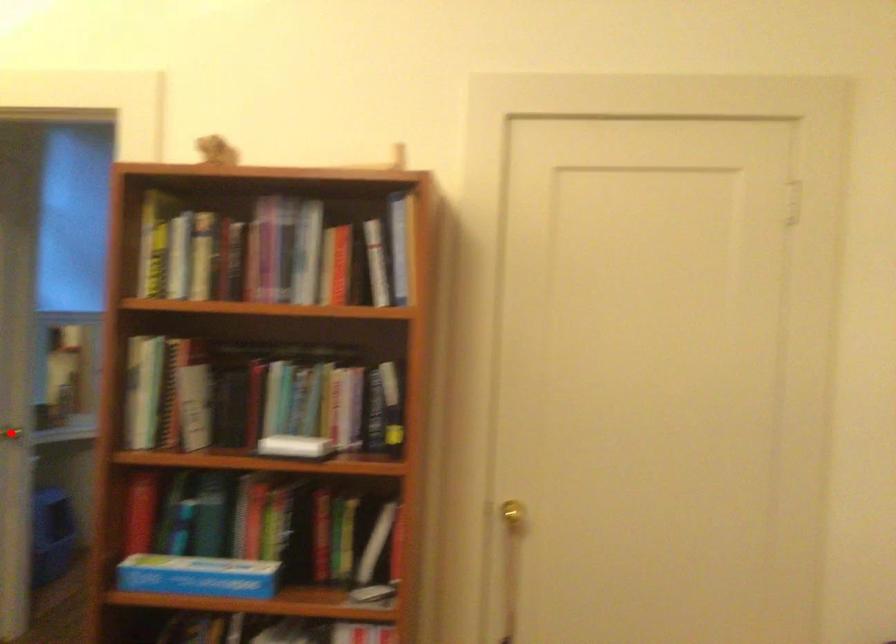
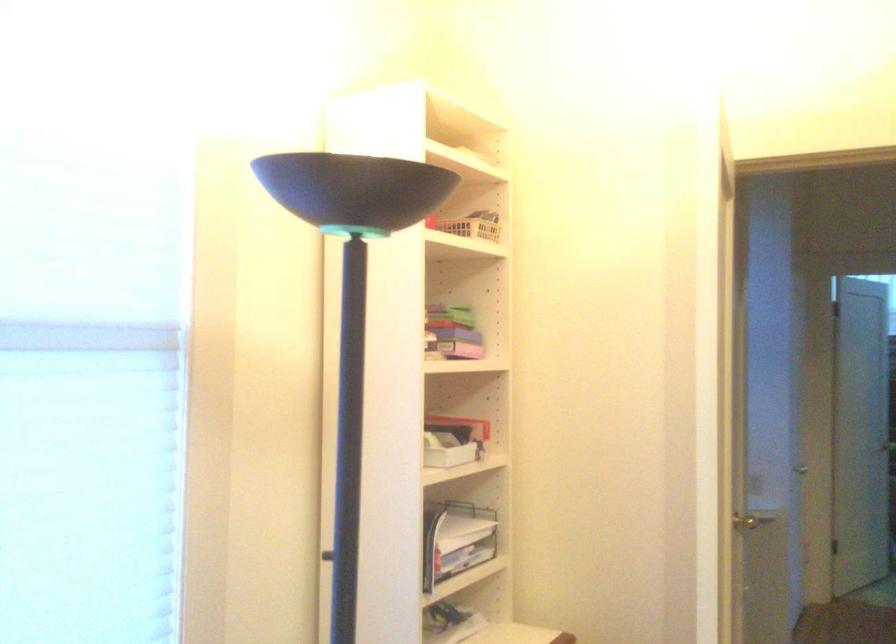
Question: I am providing you with two images of the same scene from different viewpoints. Image1 has a red point marked. In image2, the corresponding 3D location appears at what relative position? Reply with the corresponding letter.

Choices:
 (A) Closer
 (B) Farther

Answer: (B)